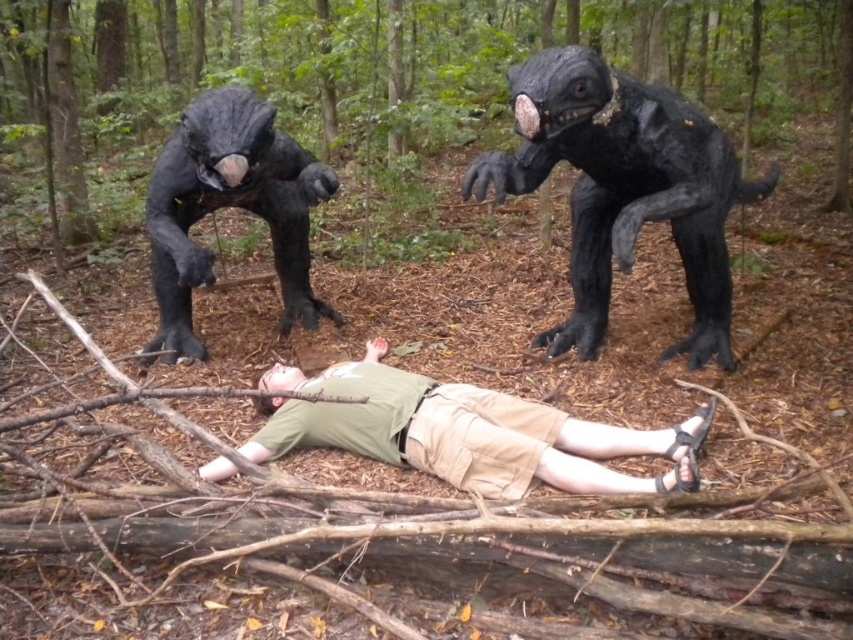
Between green cotton shirt at center and shiny black creature at upper left, which one appears on the left side from the viewer's perspective?

Positioned to the left is shiny black creature at upper left.

Between green cotton shirt at center and shiny black creature at upper left, which one is positioned lower?

green cotton shirt at center

Which is in front, point (358, 412) or point (166, 317)?

Point (358, 412) is in front.

Locate an element on the screen. The width and height of the screenshot is (853, 640). green cotton shirt at center is located at coordinates (466, 433).

Is shiny black creature at upper center below green cotton shirt at center?

Incorrect, shiny black creature at upper center is not positioned below green cotton shirt at center.

Consider the image. Who is shorter, shiny black creature at upper center or green cotton shirt at center?

green cotton shirt at center is shorter.

Image resolution: width=853 pixels, height=640 pixels. What do you see at coordinates (624, 188) in the screenshot? I see `shiny black creature at upper center` at bounding box center [624, 188].

Where is `shiny black creature at upper center`? shiny black creature at upper center is located at coordinates (624, 188).

Does shiny black creature at upper center appear on the right side of shiny black creature at upper left?

Yes, shiny black creature at upper center is to the right of shiny black creature at upper left.

Which is in front, point (619, 115) or point (282, 310)?

Point (619, 115) is more forward.

The image size is (853, 640). I want to click on shiny black creature at upper center, so click(x=624, y=188).